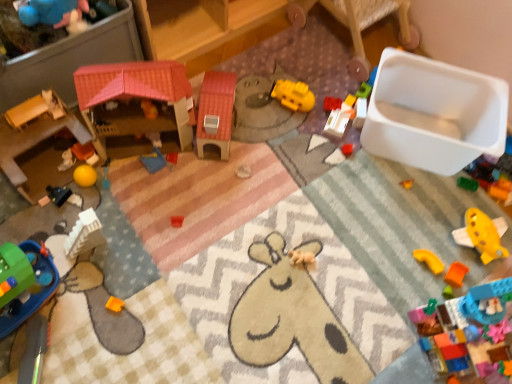
At what (x,y) coordinates should I click in order to perform the action: click on free space that is in between yellow matte plastic arch at lower right, which appears as the twelfth toy when viewed from the left, and yellow plastic block at upper center, which appears as the 11th toy when viewed from the left. Please return your answer as a coordinate pair (x, y). The width and height of the screenshot is (512, 384). Looking at the image, I should click on (394, 201).